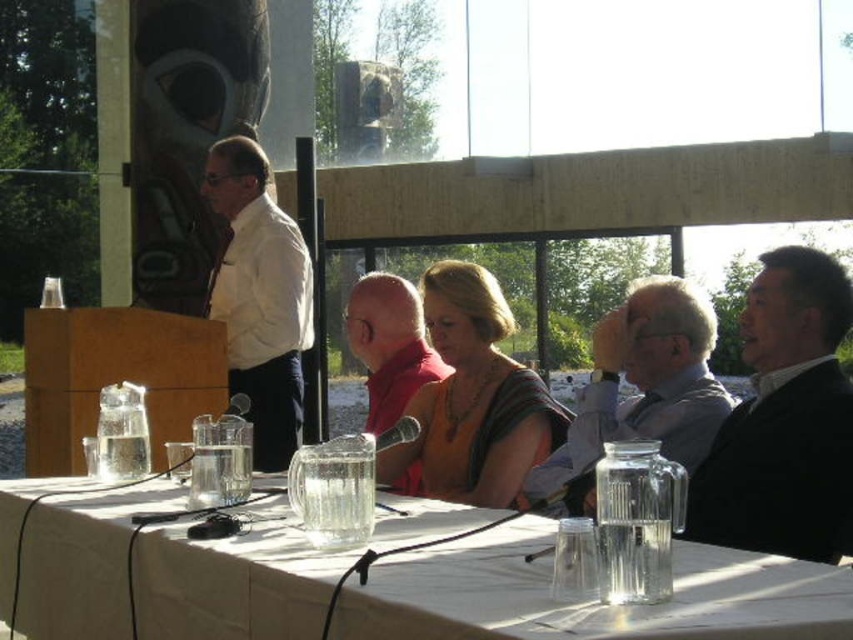
Question: Is clear glass table at center bigger than red fabric scarf at center?

Choices:
 (A) no
 (B) yes

Answer: (B)

Question: Which point is closer to the camera?

Choices:
 (A) red fabric scarf at center
 (B) gray fabric shirt at right
 (C) clear glass table at center
 (D) black suit at right

Answer: (C)

Question: Which is farther from the black suit at right?

Choices:
 (A) clear glass table at center
 (B) matte white shirt at left
 (C) gray fabric shirt at right

Answer: (B)

Question: Observing the image, what is the correct spatial positioning of matte white shirt at left in reference to red fabric scarf at center?

Choices:
 (A) right
 (B) left

Answer: (B)

Question: Among these points, which one is nearest to the camera?

Choices:
 (A) (346, 339)
 (B) (692, 317)
 (C) (844, 374)
 (D) (518, 541)

Answer: (D)

Question: Is the position of clear glass table at center less distant than that of matte white shirt at left?

Choices:
 (A) no
 (B) yes

Answer: (B)